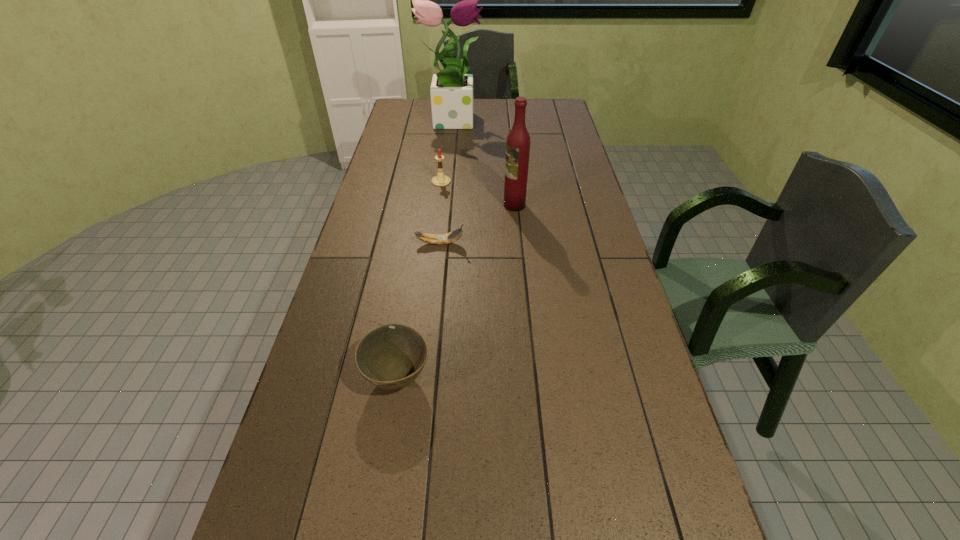
Identify the location of the farthest object. The height and width of the screenshot is (540, 960). (451, 91).

This screenshot has width=960, height=540. Identify the location of flower arrangement. (451, 91).

Image resolution: width=960 pixels, height=540 pixels. I want to click on the third nearest object, so click(x=518, y=140).

Find the location of a particular element. The width and height of the screenshot is (960, 540). the rightmost object is located at coordinates (518, 140).

Find the location of a particular element. The width and height of the screenshot is (960, 540). candle is located at coordinates (440, 180).

The image size is (960, 540). I want to click on the second farthest object, so click(440, 180).

Locate an element on the screen. This screenshot has width=960, height=540. the nearest object is located at coordinates (391, 356).

Find the location of a particular element. This screenshot has height=540, width=960. the second shortest object is located at coordinates (391, 356).

The width and height of the screenshot is (960, 540). Find the location of `the second nearest object`. the second nearest object is located at coordinates (440, 239).

I want to click on the shortest object, so click(440, 239).